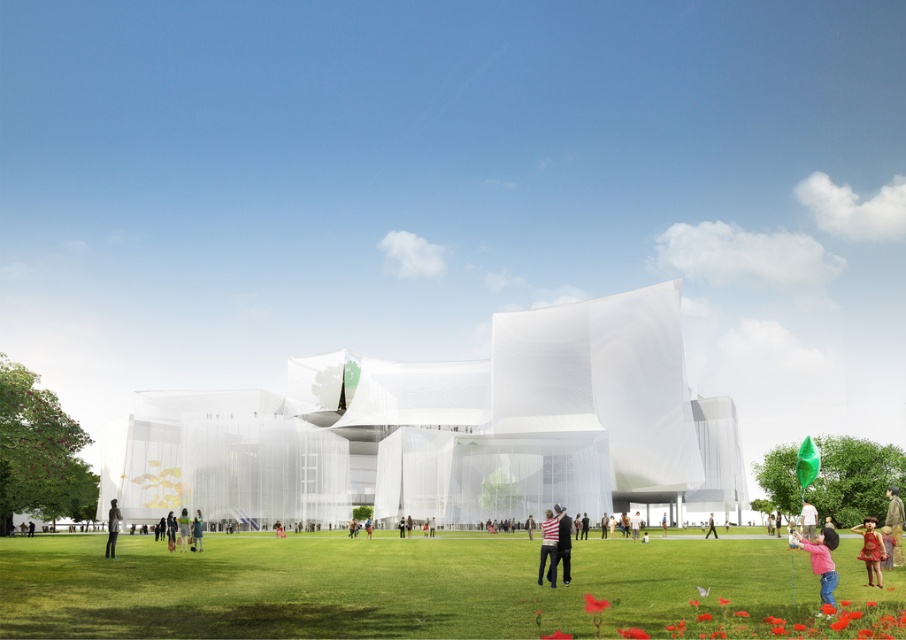
You are standing in front of the modern architectural structure with the bright blue sky and scattered white clouds. You see a pink fabric balloon at lower right. Where exactly is the pink fabric balloon located in relation to the structure?

The pink fabric balloon at lower right is located at point 0.877 on the x axis and 0.908 on the y axis.

You are standing in front of the modern architectural structure and want to walk towards the grassy area. According to the image, where exactly is the green grass at lower center located?

The green grass at lower center is located at point [422,588].